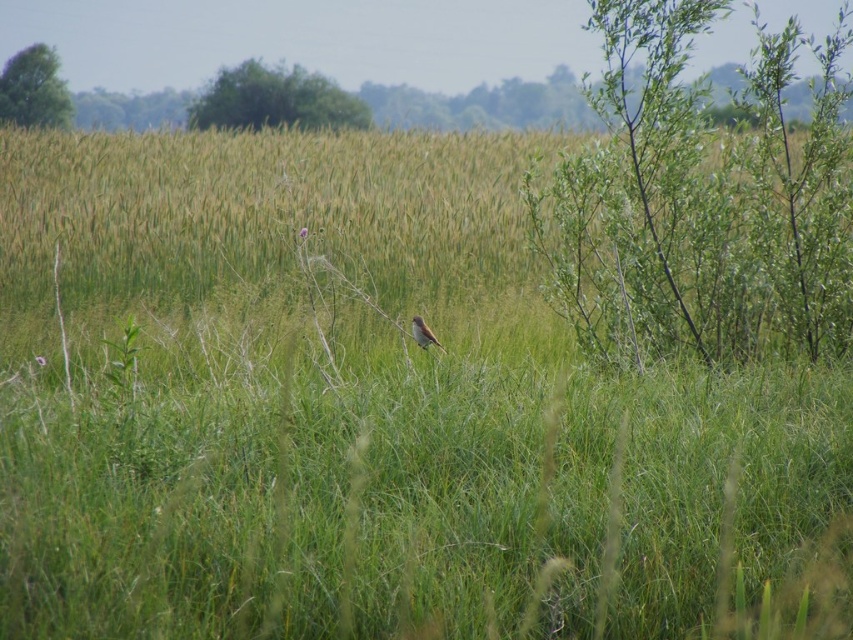
You are standing at the point marked by the coordinates point (264, 211). Looking around, you see the green grassy wheat field at center. Which direction should you walk to reach the small bird perched on one of the stems in the foreground?

The point (264, 211) marks the green grassy wheat field at center. The small bird perched on one of the stems is in the foreground, so you should walk towards the foreground direction to reach it.

In the scene shown: You are standing at the origin point in this natural landscape. There are two points marked in the scene, point (688, 291) and point (434, 337). Which point is closer to you?

Point (434, 337) is closer to you because it is in front of point (688, 291), which is behind it.